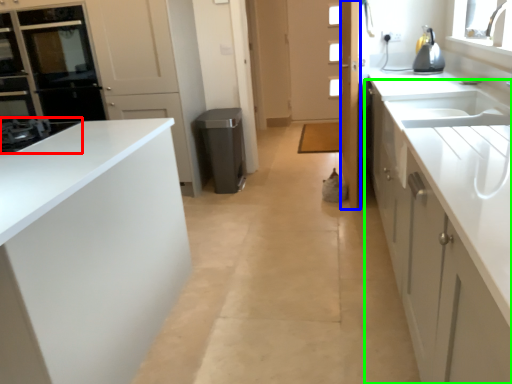
Question: Which is farther away from home appliance (highlighted by a red box)? door (highlighted by a blue box) or cabinetry (highlighted by a green box)?

Choices:
 (A) door
 (B) cabinetry

Answer: (A)